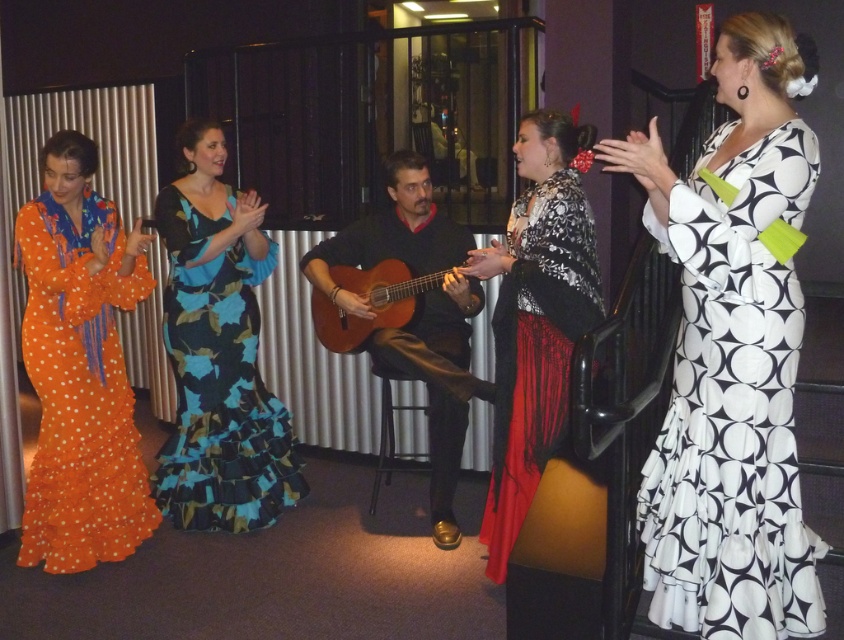
Is the position of black lace dress at center more distant than that of wooden acoustic guitar at center?

No, it is in front of wooden acoustic guitar at center.

Image resolution: width=844 pixels, height=640 pixels. Identify the location of black lace dress at center. (536, 316).

Between point (582, 292) and point (360, 292), which one is positioned behind?

The point (360, 292) is behind.

Where is `black lace dress at center`? black lace dress at center is located at coordinates (536, 316).

Is matte black guitar at center shorter than black metal stool at center?

In fact, matte black guitar at center may be taller than black metal stool at center.

Does matte black guitar at center appear over black metal stool at center?

Yes, matte black guitar at center is above black metal stool at center.

Between point (442, 403) and point (375, 372), which one is positioned behind?

The point (375, 372) is behind.

The height and width of the screenshot is (640, 844). In order to click on matte black guitar at center in this screenshot , I will do `click(415, 316)`.

Between black and white printed dress at right and black lace dress at center, which one is positioned lower?

black and white printed dress at right is below.

Does black and white printed dress at right have a larger size compared to black lace dress at center?

No, black and white printed dress at right is not bigger than black lace dress at center.

The height and width of the screenshot is (640, 844). Find the location of `black and white printed dress at right`. black and white printed dress at right is located at coordinates (732, 404).